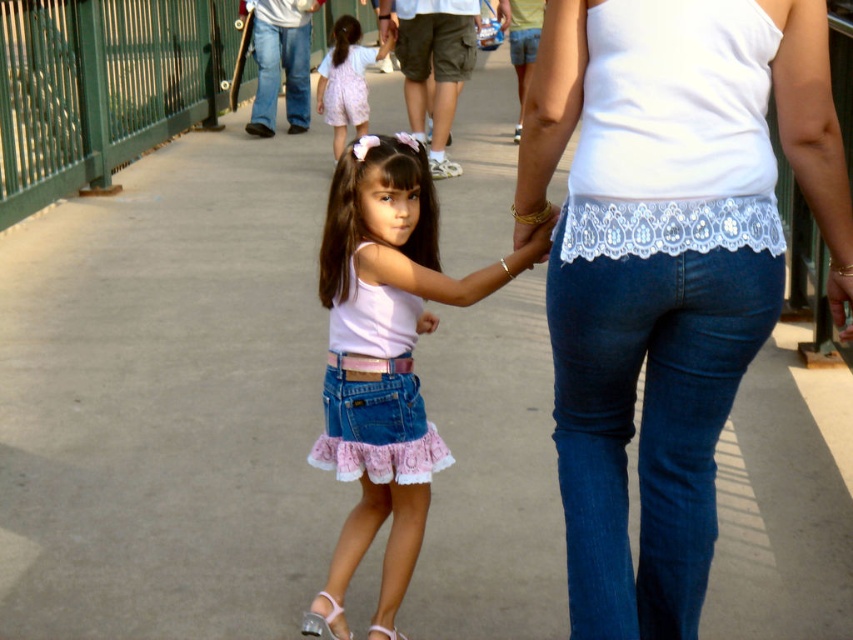
Question: Is denim jeans at center closer to camera compared to pink denim skirt at center?

Choices:
 (A) no
 (B) yes

Answer: (B)

Question: Which point is closer to the camera?

Choices:
 (A) clear plastic sandal at lower center
 (B) pink lace dress at center
 (C) white leather sandal at lower center
 (D) denim jeans at center

Answer: (D)

Question: Is pink denim skirt at center below clear plastic sandal at lower center?

Choices:
 (A) yes
 (B) no

Answer: (B)

Question: Among these points, which one is nearest to the camera?

Choices:
 (A) (454, 304)
 (B) (596, 340)

Answer: (B)

Question: Which of the following is the farthest from the observer?

Choices:
 (A) (328, 440)
 (B) (351, 632)
 (C) (369, 636)
 (D) (339, 128)

Answer: (D)

Question: Can you confirm if denim jeans at center is positioned to the left of clear plastic sandal at lower center?

Choices:
 (A) no
 (B) yes

Answer: (A)